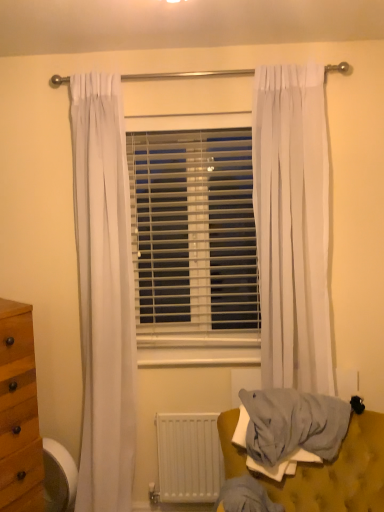
Question: Is white sheer curtain at right to the right of white plastic blinds at center from the viewer's perspective?

Choices:
 (A) yes
 (B) no

Answer: (A)

Question: From a real-world perspective, is white sheer curtain at right located higher than white plastic blinds at center?

Choices:
 (A) no
 (B) yes

Answer: (B)

Question: Is white sheer curtain at right closer to the viewer compared to white plastic blinds at center?

Choices:
 (A) yes
 (B) no

Answer: (A)

Question: Can white plastic blinds at center be found inside white sheer curtain at right?

Choices:
 (A) yes
 (B) no

Answer: (B)

Question: Is white sheer curtain at right oriented away from white plastic blinds at center?

Choices:
 (A) yes
 (B) no

Answer: (B)

Question: Can you confirm if white sheer curtain at right is shorter than white plastic blinds at center?

Choices:
 (A) yes
 (B) no

Answer: (B)

Question: Does wooden swivel chair at lower left have a greater height compared to light gray fabric at lower right?

Choices:
 (A) no
 (B) yes

Answer: (A)

Question: Is light gray fabric at lower right completely or partially inside wooden swivel chair at lower left?

Choices:
 (A) no
 (B) yes

Answer: (A)

Question: From a real-world perspective, is wooden swivel chair at lower left under light gray fabric at lower right?

Choices:
 (A) yes
 (B) no

Answer: (A)

Question: From a real-world perspective, is wooden swivel chair at lower left on light gray fabric at lower right?

Choices:
 (A) no
 (B) yes

Answer: (A)

Question: From the image's perspective, would you say wooden swivel chair at lower left is shown under light gray fabric at lower right?

Choices:
 (A) yes
 (B) no

Answer: (A)

Question: Is light gray fabric at lower right at the back of wooden swivel chair at lower left?

Choices:
 (A) yes
 (B) no

Answer: (B)

Question: Is white plastic blinds at center thinner than light gray fabric at lower right?

Choices:
 (A) yes
 (B) no

Answer: (A)